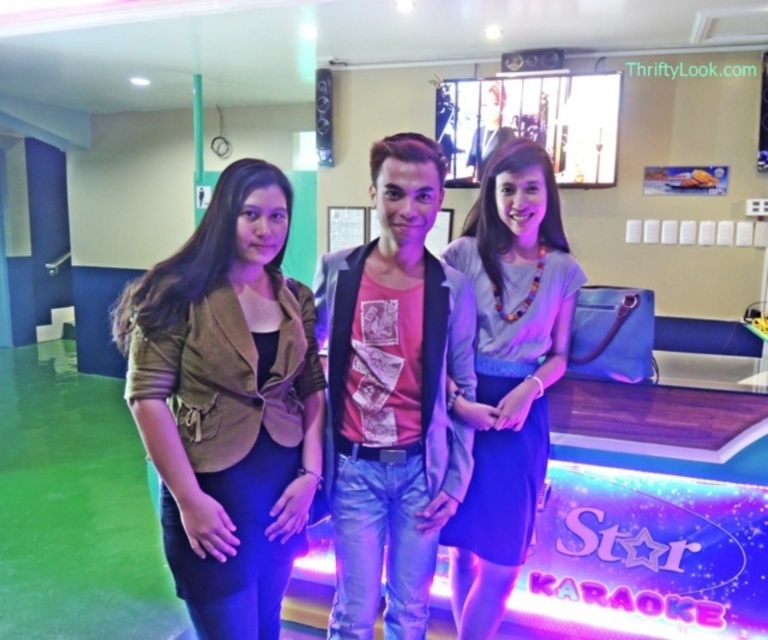
Question: Is brown suede blazer at left closer to camera compared to matte gray dress at center?

Choices:
 (A) yes
 (B) no

Answer: (A)

Question: Which object is farther from the camera taking this photo?

Choices:
 (A) brown suede blazer at left
 (B) matte gray dress at center

Answer: (B)

Question: In this image, where is brown suede blazer at left located relative to matte gray dress at center?

Choices:
 (A) below
 (B) above

Answer: (B)

Question: Which point is farther from the camera taking this photo?

Choices:
 (A) (212, 436)
 (B) (475, 493)

Answer: (B)

Question: Does brown suede blazer at left appear over matte gray dress at center?

Choices:
 (A) yes
 (B) no

Answer: (A)